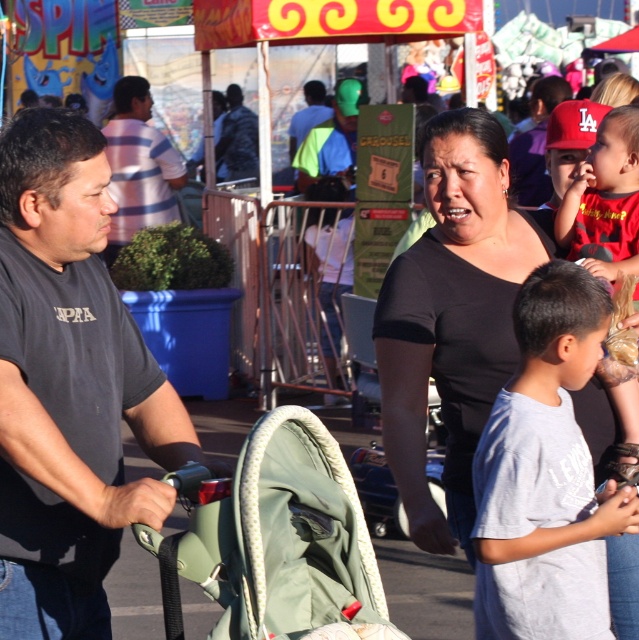
Which is in front, point (81, 417) or point (196, 476)?

Point (196, 476) is in front.

Which is behind, point (3, 520) or point (358, 524)?

Point (3, 520)

Does point (36, 522) come in front of point (258, 524)?

No, (36, 522) is behind (258, 524).

Identify the location of black matte shirt at left. The height and width of the screenshot is (640, 639). (70, 387).

Does dark blue jacket at center appear under blue fabric shirt at center?

Yes.

Can you confirm if dark blue jacket at center is shorter than blue fabric shirt at center?

In fact, dark blue jacket at center may be taller than blue fabric shirt at center.

Is point (249, 172) farther from camera compared to point (312, 83)?

Yes, it is behind point (312, 83).

At what (x,y) coordinates should I click in order to perform the action: click on dark blue jacket at center. Please return your answer as a coordinate pair (x, y). The image size is (639, 640). Looking at the image, I should click on (236, 138).

Is green fabric baby carriage at center wider than striped cotton shirt at left?

Incorrect, green fabric baby carriage at center's width does not surpass striped cotton shirt at left's.

Between green fabric baby carriage at center and striped cotton shirt at left, which one has less height?

green fabric baby carriage at center is shorter.

Locate an element on the screen. green fabric baby carriage at center is located at coordinates (273, 540).

You are a GUI agent. You are given a task and a screenshot of the screen. Output one action in this format:
    pyautogui.click(x=<x>, y=<y>)
    Task: Click on the green fabric baby carriage at center
    This screenshot has width=639, height=640.
    Given the screenshot: What is the action you would take?
    pyautogui.click(x=273, y=540)